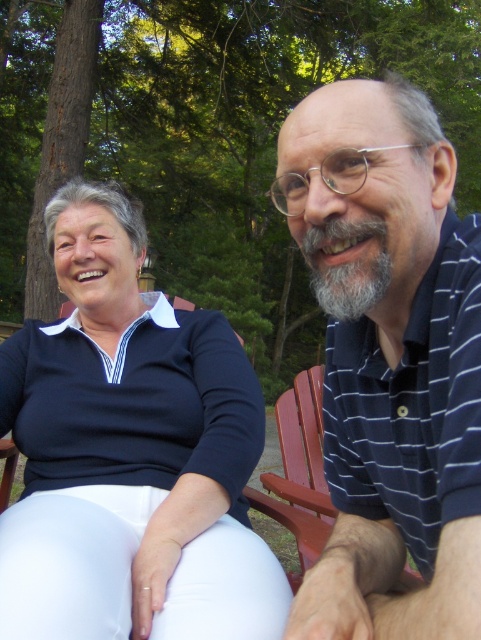
Does striped polo shirt at right appear on the right side of red wood chair at right?

Incorrect, striped polo shirt at right is not on the right side of red wood chair at right.

Does striped polo shirt at right have a smaller size compared to red wood chair at right?

Yes.

Who is more distant from viewer, (372, 609) or (294, 484)?

The point (294, 484) is behind.

You are a GUI agent. You are given a task and a screenshot of the screen. Output one action in this format:
    pyautogui.click(x=<x>, y=<y>)
    Task: Click on the striped polo shirt at right
    This screenshot has width=481, height=640.
    Given the screenshot: What is the action you would take?
    pyautogui.click(x=389, y=360)

Between matte black shirt at left and red wood chair at right, which one has less height?

Standing shorter between the two is red wood chair at right.

Can you confirm if matte black shirt at left is bigger than red wood chair at right?

Yes.

Is point (176, 602) less distant than point (295, 540)?

Yes, it is.

Identify the location of matte black shirt at left. (129, 452).

This screenshot has width=481, height=640. I want to click on matte black shirt at left, so click(x=129, y=452).

Does matte black shirt at left have a greater height compared to striped polo shirt at right?

Indeed, matte black shirt at left has a greater height compared to striped polo shirt at right.

Between point (134, 339) and point (390, 109), which one is positioned behind?

The point (134, 339) is more distant.

Identify the location of matte black shirt at left. The height and width of the screenshot is (640, 481). (129, 452).